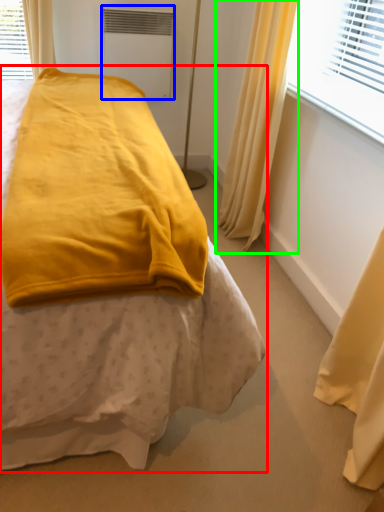
Question: Considering the real-world distances, which object is closest to bed (highlighted by a red box)? air conditioning (highlighted by a blue box) or curtain (highlighted by a green box).

Choices:
 (A) air conditioning
 (B) curtain

Answer: (B)